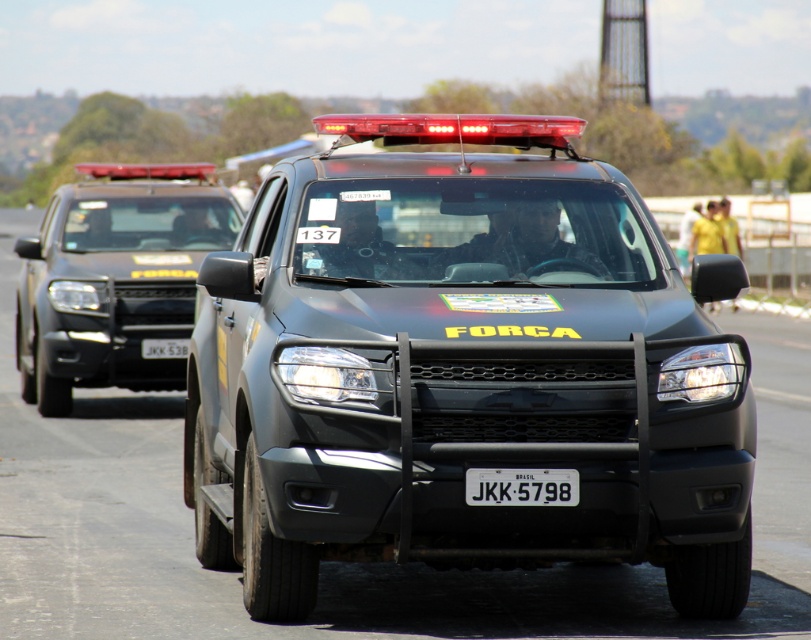
Question: Does matte black truck at center appear over black plastic license plate at center?

Choices:
 (A) no
 (B) yes

Answer: (B)

Question: Which point is closer to the camera?

Choices:
 (A) white plastic license plate at center
 (B) black plastic license plate at center

Answer: (B)

Question: Is matte black suv at left positioned behind black plastic license plate at center?

Choices:
 (A) yes
 (B) no

Answer: (A)

Question: Among these points, which one is nearest to the camera?

Choices:
 (A) (144, 177)
 (B) (488, 500)
 (C) (177, 342)

Answer: (B)

Question: Which point is farther to the camera?

Choices:
 (A) (153, 356)
 (B) (230, 445)
 (C) (138, 273)
 (D) (577, 493)

Answer: (C)

Question: Does matte black suv at left appear under white plastic license plate at center?

Choices:
 (A) yes
 (B) no

Answer: (B)